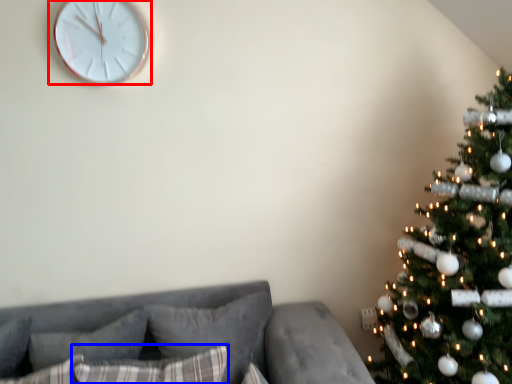
Question: Which object appears closest to the camera in this image, wall clock (highlighted by a red box) or pillow (highlighted by a blue box)?

Choices:
 (A) wall clock
 (B) pillow

Answer: (B)